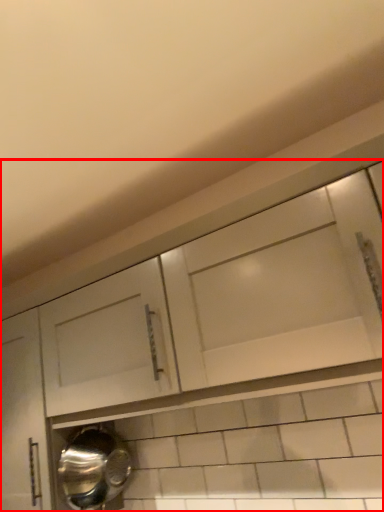
Question: From the image's perspective, what is the correct spatial positioning of cabinetry (annotated by the red box) in reference to water heater?

Choices:
 (A) above
 (B) below

Answer: (A)